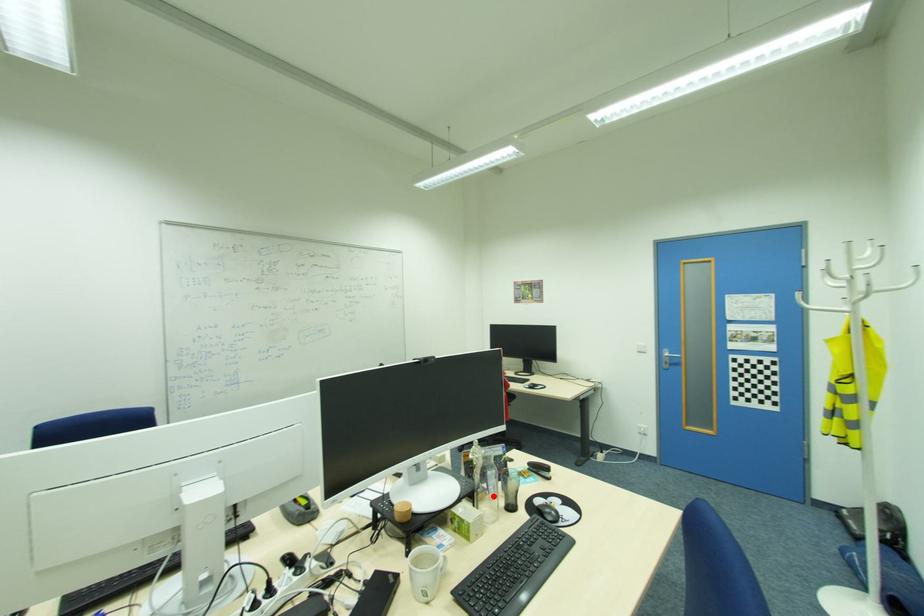
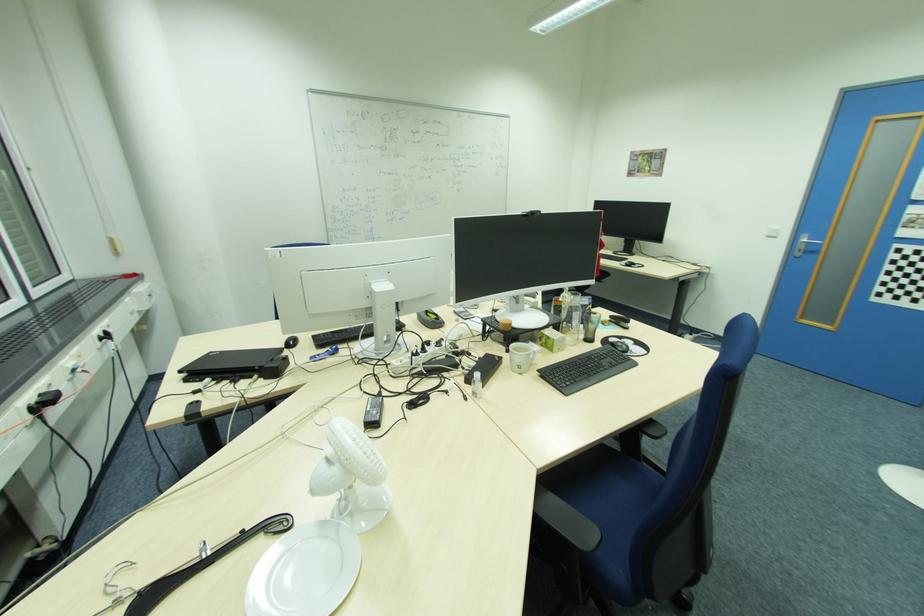
Locate, in the second image, the point that corresponds to the highlighted location in the first image.

(576, 331)